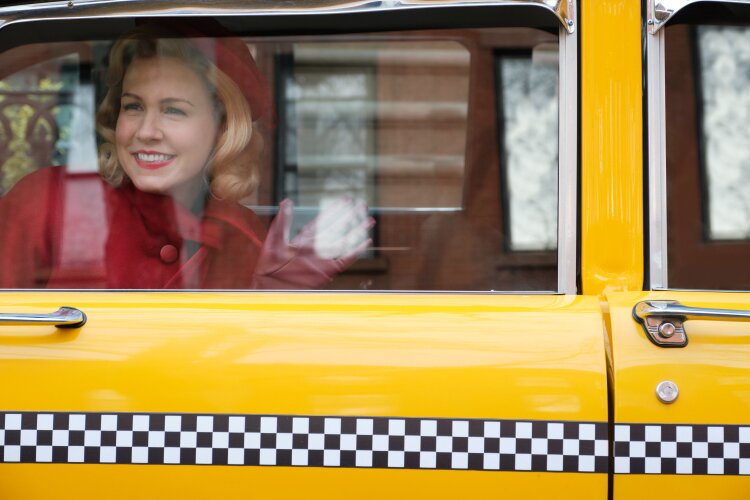
Locate an element on the screen. Image resolution: width=750 pixels, height=500 pixels. doors is located at coordinates (426, 369), (718, 392).